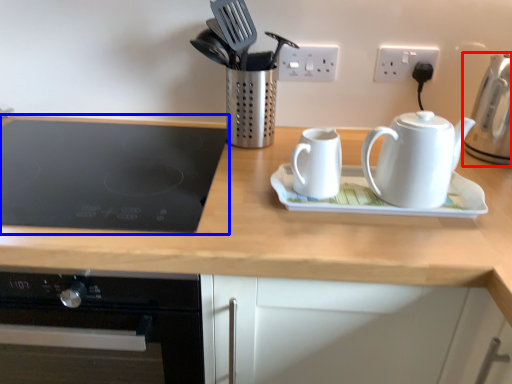
Question: Which point is further to the camera, kettle (highlighted by a red box) or gas stove (highlighted by a blue box)?

Choices:
 (A) kettle
 (B) gas stove

Answer: (A)